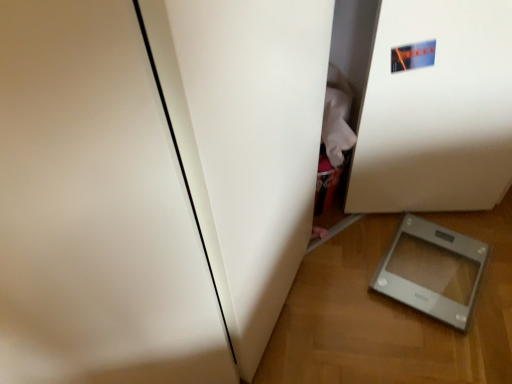
Find the location of a particular element. This screenshot has width=512, height=384. free space in front of silver plastic scale at lower right is located at coordinates (444, 346).